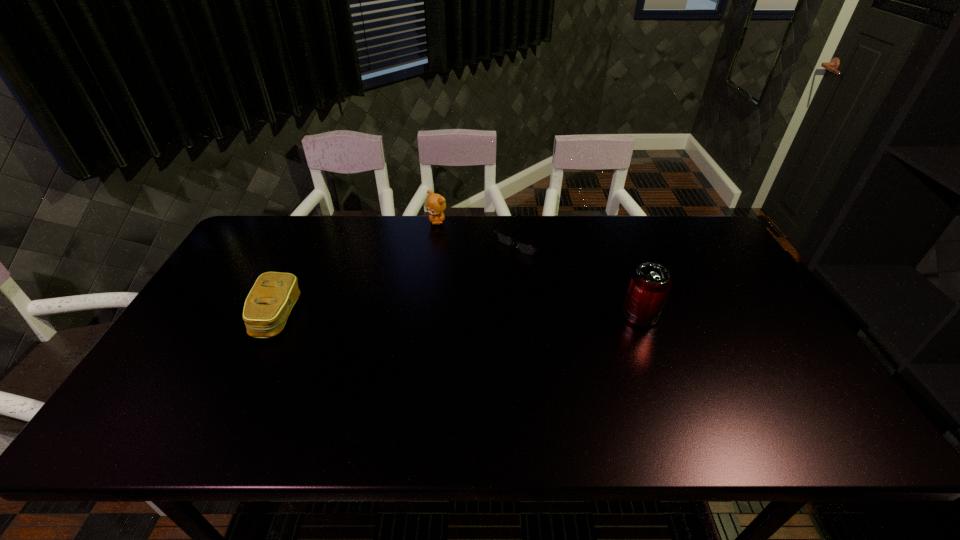
Image resolution: width=960 pixels, height=540 pixels. I want to click on vacant space on the desktop that is between the leftmost object and the soda can and is positioned on the front-facing side of the second object from right to left, so click(435, 316).

Where is `free spot on the desktop that is between the third tallest object and the tallest object and is positioned on the face of the third object from right to left`? The height and width of the screenshot is (540, 960). free spot on the desktop that is between the third tallest object and the tallest object and is positioned on the face of the third object from right to left is located at coordinates (445, 316).